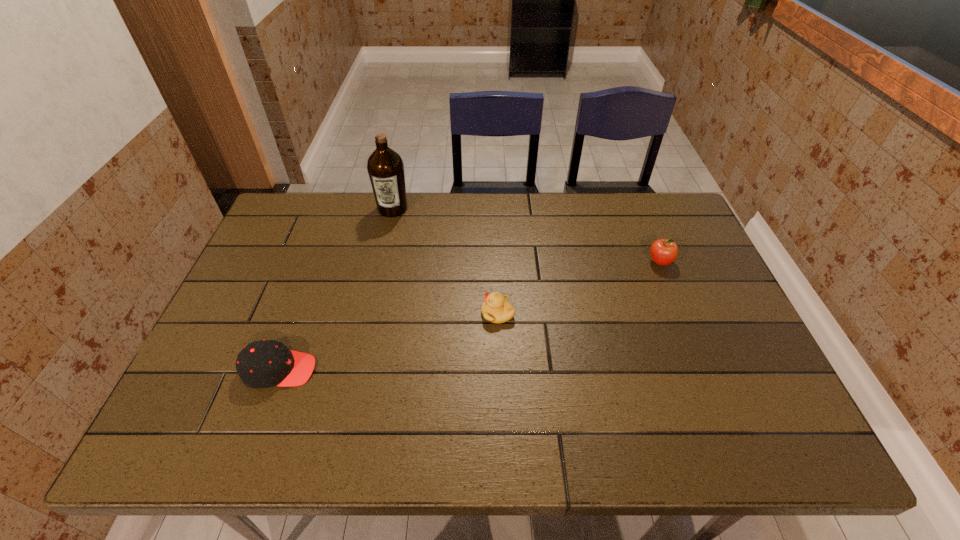
Locate an element on the screen. vacant area between the farthest object and the nearest object is located at coordinates (336, 289).

Locate an element on the screen. This screenshot has height=540, width=960. vacant area between the farthest object and the third object from left to right is located at coordinates (445, 261).

This screenshot has height=540, width=960. In order to click on object that ranks as the second closest to the apple in this screenshot , I will do `click(385, 167)`.

Identify which object is the third nearest to the olive oil. Please provide its 2D coordinates. Your answer should be formatted as a tuple, i.e. [(x, y)], where the tuple contains the x and y coordinates of a point satisfying the conditions above.

[(663, 252)]

In order to click on free space that satisfies the following two spatial constraints: 1. on the label of the second object from left to right; 2. on the front-facing side of the leftmost object in this screenshot , I will do `click(356, 370)`.

Identify the location of free point that satisfies the following two spatial constraints: 1. on the label of the tallest object; 2. on the front-facing side of the cap. (356, 370).

Locate an element on the screen. vacant space that satisfies the following two spatial constraints: 1. on the label of the third shortest object; 2. on the left side of the olive oil is located at coordinates pos(381,262).